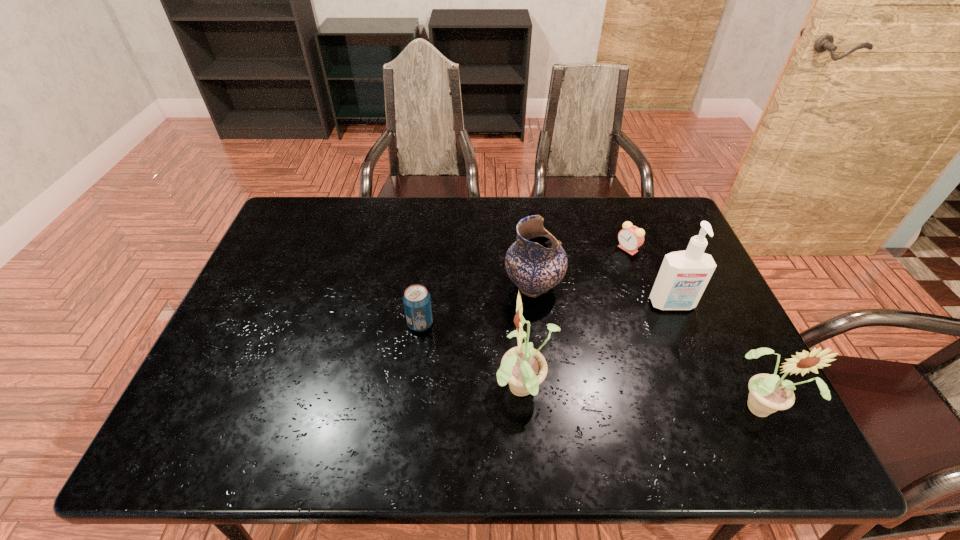
Considering the uniform spacing of sunflowers, where should an additional sunflower be positioned on the left? Please locate a free spot. Please provide its 2D coordinates. Your answer should be formatted as a tuple, i.e. [(x, y)], where the tuple contains the x and y coordinates of a point satisfying the conditions above.

[(300, 377)]